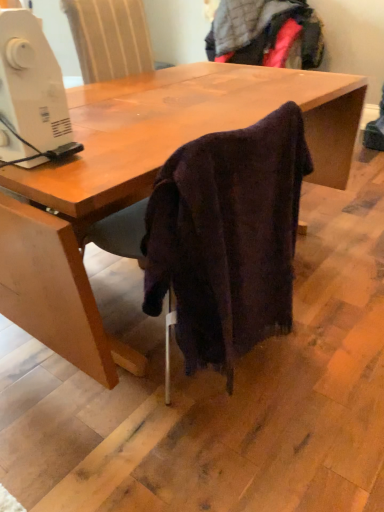
Question: Should I look upward or downward to see dark woolen sweater at lower center?

Choices:
 (A) down
 (B) up

Answer: (B)

Question: Does white plastic sewing machine at left have a smaller size compared to dark woolen sweater at lower center?

Choices:
 (A) yes
 (B) no

Answer: (A)

Question: Is white plastic sewing machine at left thinner than dark woolen sweater at lower center?

Choices:
 (A) yes
 (B) no

Answer: (A)

Question: Does white plastic sewing machine at left have a greater width compared to dark woolen sweater at lower center?

Choices:
 (A) yes
 (B) no

Answer: (B)

Question: Can you confirm if white plastic sewing machine at left is positioned to the right of dark woolen sweater at lower center?

Choices:
 (A) yes
 (B) no

Answer: (B)

Question: From a real-world perspective, is white plastic sewing machine at left physically above dark woolen sweater at lower center?

Choices:
 (A) no
 (B) yes

Answer: (B)

Question: Considering the relative positions of white plastic sewing machine at left and dark woolen sweater at lower center in the image provided, is white plastic sewing machine at left to the left of dark woolen sweater at lower center from the viewer's perspective?

Choices:
 (A) yes
 (B) no

Answer: (A)

Question: Considering the relative positions of dark woolen sweater at lower center and white plastic sewing machine at left in the image provided, is dark woolen sweater at lower center to the right of white plastic sewing machine at left from the viewer's perspective?

Choices:
 (A) no
 (B) yes

Answer: (B)

Question: Is dark woolen sweater at lower center outside white plastic sewing machine at left?

Choices:
 (A) no
 (B) yes

Answer: (B)

Question: Does dark woolen sweater at lower center have a larger size compared to white plastic sewing machine at left?

Choices:
 (A) yes
 (B) no

Answer: (A)

Question: Is dark woolen sweater at lower center closer to the viewer compared to white plastic sewing machine at left?

Choices:
 (A) no
 (B) yes

Answer: (A)

Question: From a real-world perspective, is dark woolen sweater at lower center on top of white plastic sewing machine at left?

Choices:
 (A) yes
 (B) no

Answer: (B)

Question: Considering the relative sizes of dark woolen sweater at lower center and white plastic sewing machine at left in the image provided, is dark woolen sweater at lower center wider than white plastic sewing machine at left?

Choices:
 (A) yes
 (B) no

Answer: (A)

Question: From a real-world perspective, is dark woolen sweater at lower center above or below white plastic sewing machine at left?

Choices:
 (A) below
 (B) above

Answer: (A)